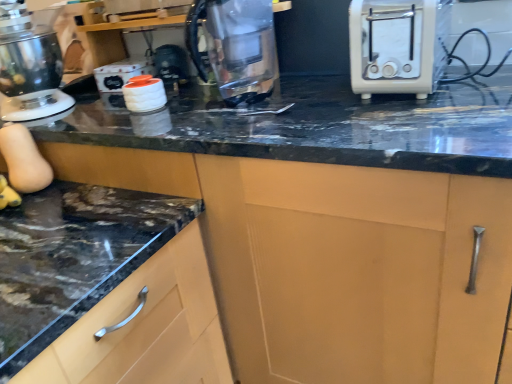
Locate an element on the screen. The image size is (512, 384). vacant space to the left of white plastic toaster at right is located at coordinates click(320, 109).